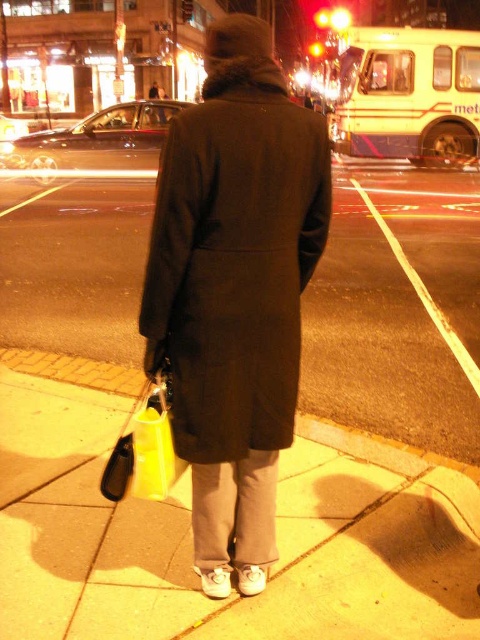
Is gray concrete sidewalk at center behind dark wool coat at center?

Yes, it is.

Can you confirm if gray concrete sidewalk at center is positioned below dark wool coat at center?

Yes, gray concrete sidewalk at center is below dark wool coat at center.

Find the location of `gray concrete sidewalk at center`. gray concrete sidewalk at center is located at coordinates (190, 536).

You are a GUI agent. You are given a task and a screenshot of the screen. Output one action in this format:
    pyautogui.click(x=<x>, y=<y>)
    Task: Click on the gray concrete sidewalk at center
    The height and width of the screenshot is (640, 480).
    Given the screenshot: What is the action you would take?
    pyautogui.click(x=190, y=536)